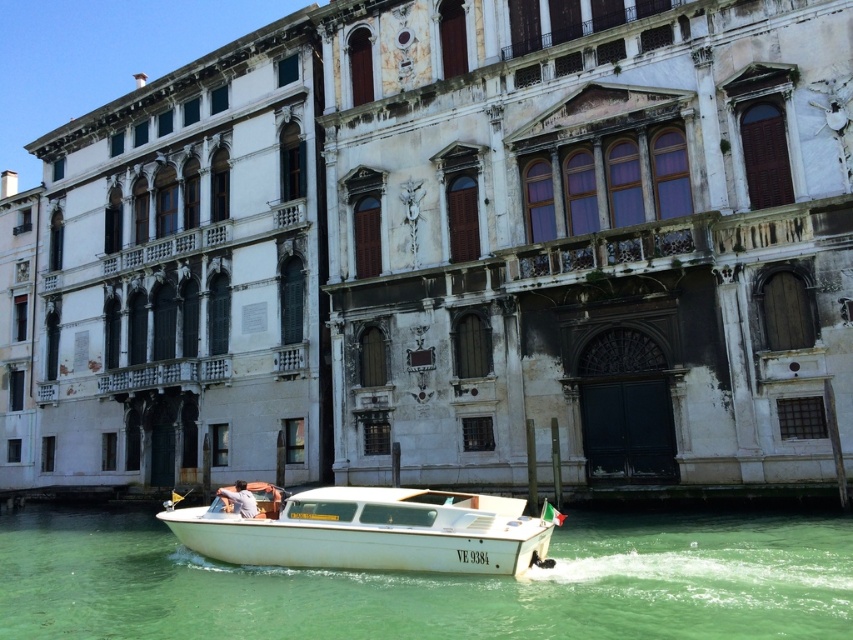
Question: Is green water at boat front wider than white glossy boat at center?

Choices:
 (A) yes
 (B) no

Answer: (A)

Question: Is green water at boat front behind white glossy boat at center?

Choices:
 (A) yes
 (B) no

Answer: (B)

Question: Which object appears farthest from the camera in this image?

Choices:
 (A) light blue shirt at center
 (B) green water at boat front

Answer: (A)

Question: Can you confirm if green water at boat front is positioned to the left of light blue shirt at center?

Choices:
 (A) yes
 (B) no

Answer: (B)

Question: Which object is positioned closest to the light blue shirt at center?

Choices:
 (A) white glossy boat at center
 (B) green water at boat front

Answer: (A)

Question: Among these points, which one is farthest from the camera?

Choices:
 (A) (234, 492)
 (B) (352, 518)

Answer: (A)